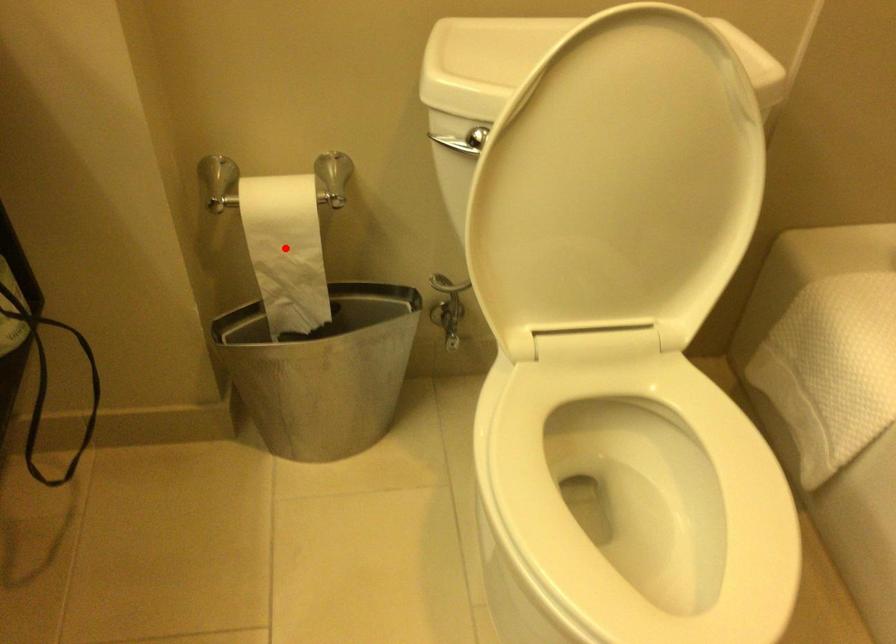
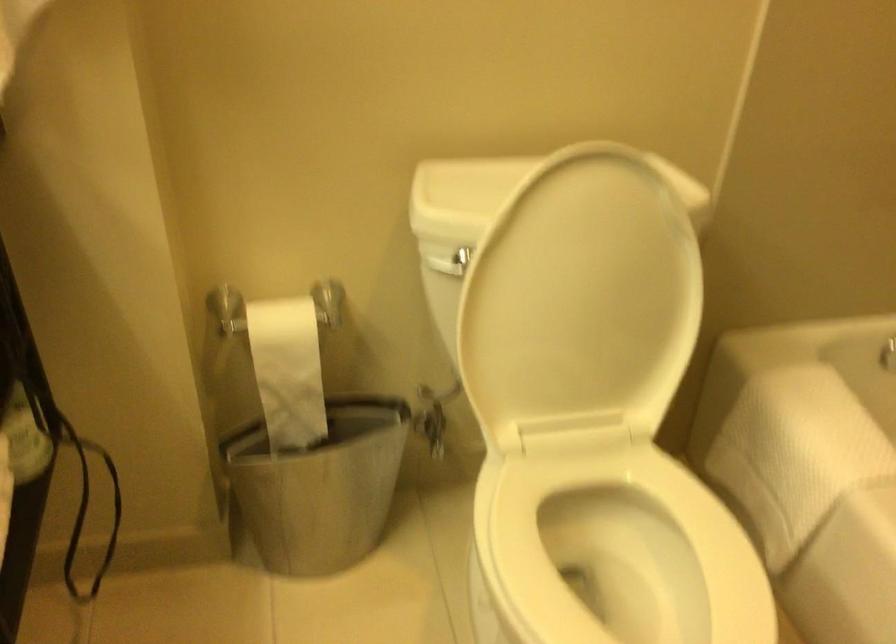
Question: I am providing you with two images of the same scene from different viewpoints. Given a red point in image1, look at the same physical point in image2. Is it:

Choices:
 (A) Closer to the viewpoint
 (B) Farther from the viewpoint

Answer: (B)